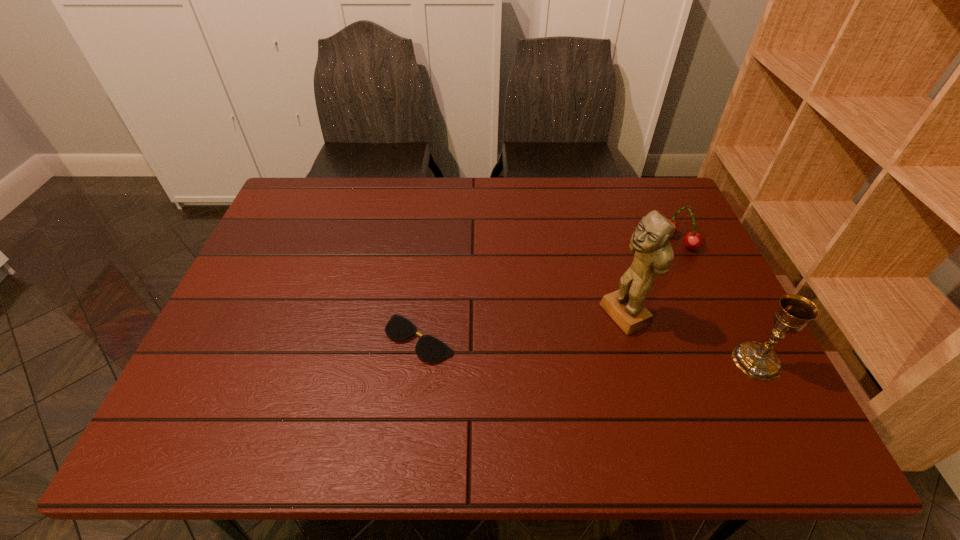
Identify the location of vacant space at the near edge of the desktop. This screenshot has width=960, height=540. (645, 379).

This screenshot has height=540, width=960. Find the location of `free region at the left edge of the desktop`. free region at the left edge of the desktop is located at coordinates (300, 281).

The width and height of the screenshot is (960, 540). Identify the location of vacant space at the right edge of the desktop. (684, 296).

The width and height of the screenshot is (960, 540). What are the coordinates of `vacant space at the far left corner of the desktop` in the screenshot? It's located at (293, 209).

Where is `free space at the near left corner`? free space at the near left corner is located at coordinates (197, 393).

Image resolution: width=960 pixels, height=540 pixels. In the image, there is a desktop. Identify the location of vacant space at the far right corner. (658, 190).

Find the location of `free area in between the second object from left to right and the second tallest object`. free area in between the second object from left to right and the second tallest object is located at coordinates (690, 338).

At what (x,y) coordinates should I click in order to perform the action: click on free spot between the farthest object and the third shortest object. Please return your answer as a coordinate pair (x, y). The height and width of the screenshot is (540, 960). Looking at the image, I should click on (717, 301).

At what (x,y) coordinates should I click in order to perform the action: click on free point between the chalice and the second shortest object. Please return your answer as a coordinate pair (x, y). Looking at the image, I should click on (717, 301).

The width and height of the screenshot is (960, 540). I want to click on free spot between the third shortest object and the spectacles, so click(588, 350).